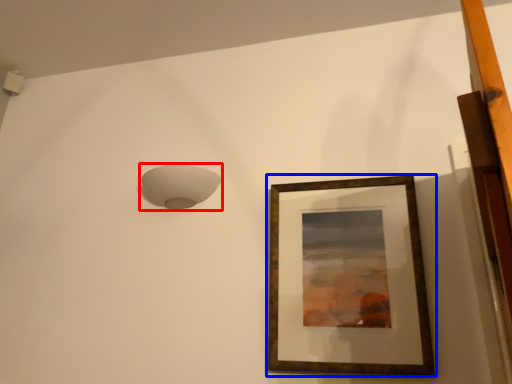
Question: Which object appears farthest to the camera in this image, lamp (highlighted by a red box) or picture frame (highlighted by a blue box)?

Choices:
 (A) lamp
 (B) picture frame

Answer: (A)